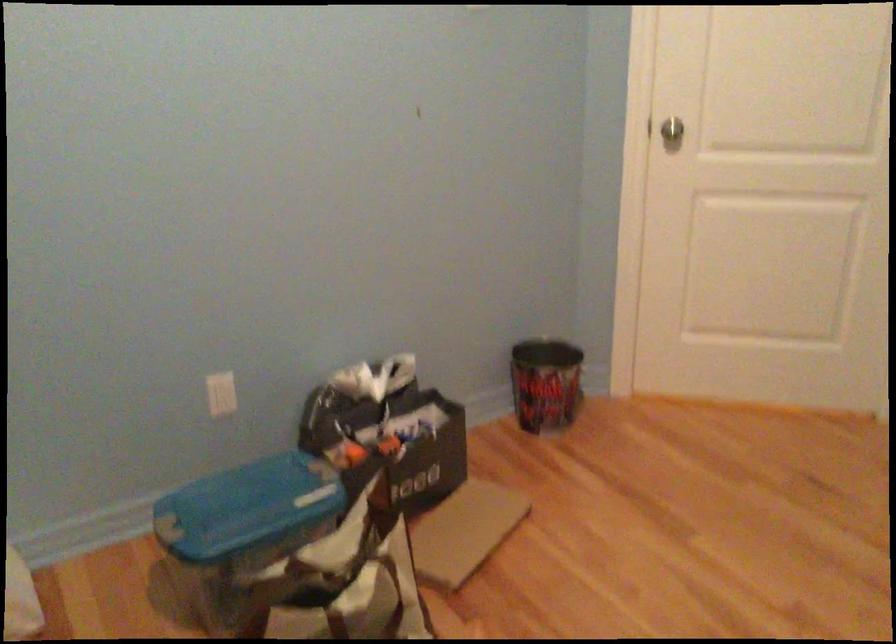
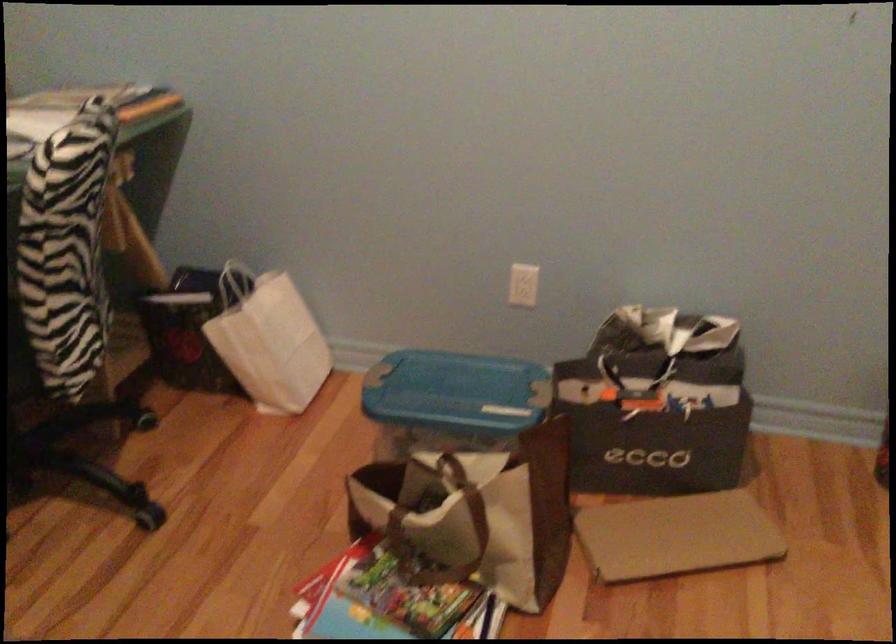
The point at (364, 435) is marked in the first image. Where is the corresponding point in the second image?

(634, 383)